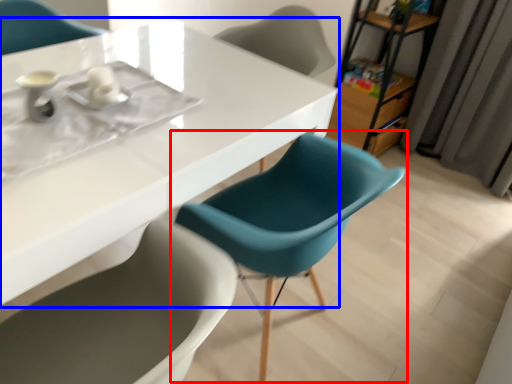
Question: Which object appears farthest to the camera in this image, chair (highlighted by a red box) or table (highlighted by a blue box)?

Choices:
 (A) chair
 (B) table

Answer: (A)